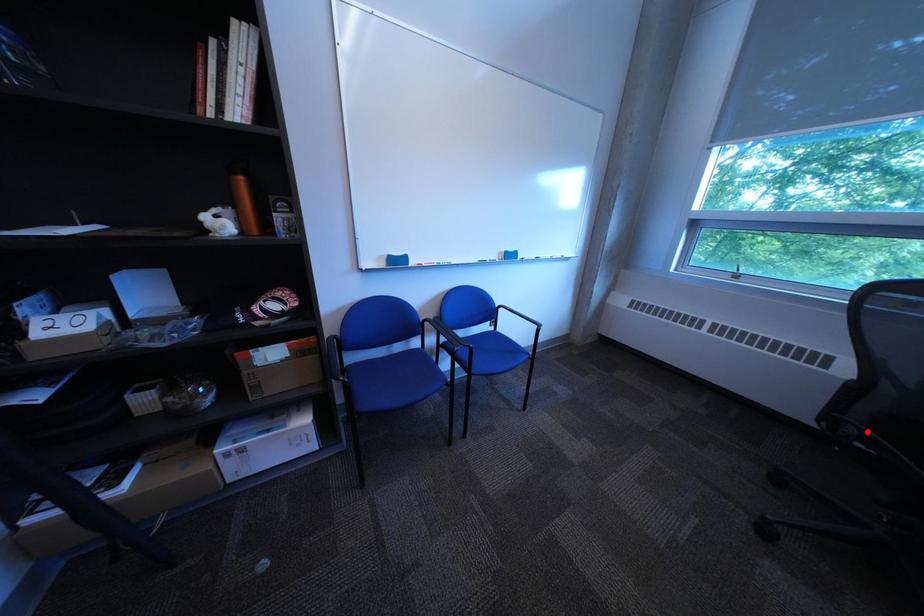
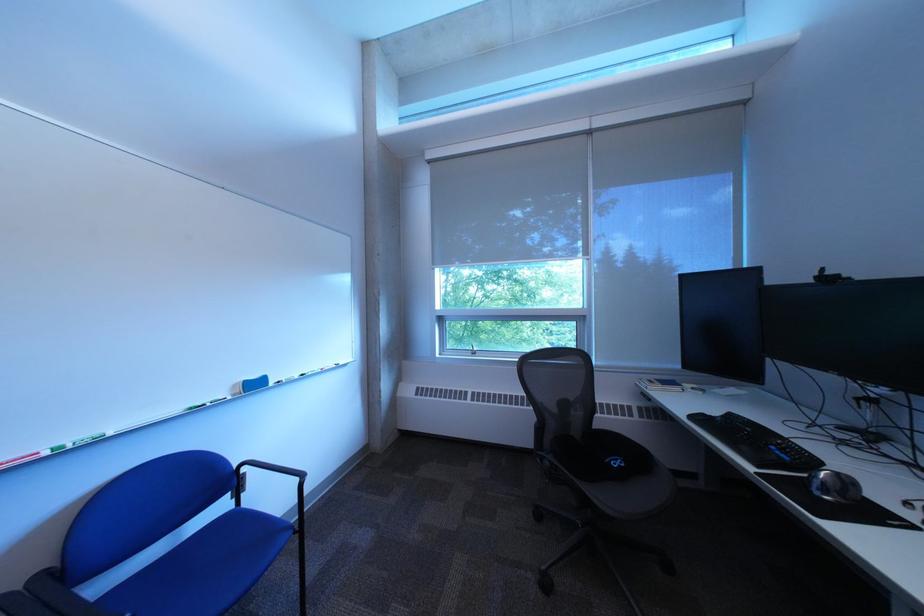
Question: I am providing you with two images of the same scene from different viewpoints. In image1, a red point is highlighted. Considering the same 3D point in image2, which of the following is correct?

Choices:
 (A) It is closer
 (B) It is farther

Answer: (A)